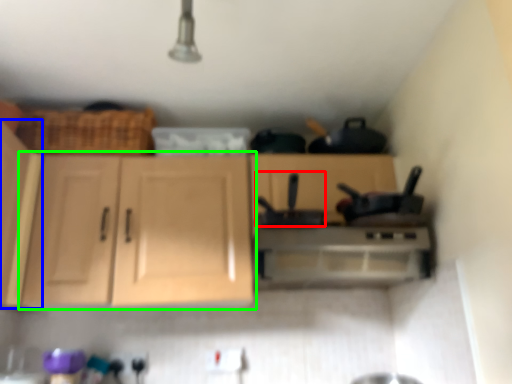
Question: Which is farther away from appliance (highlighted by a red box)? cabinetry (highlighted by a blue box) or cabinetry (highlighted by a green box)?

Choices:
 (A) cabinetry
 (B) cabinetry

Answer: (A)